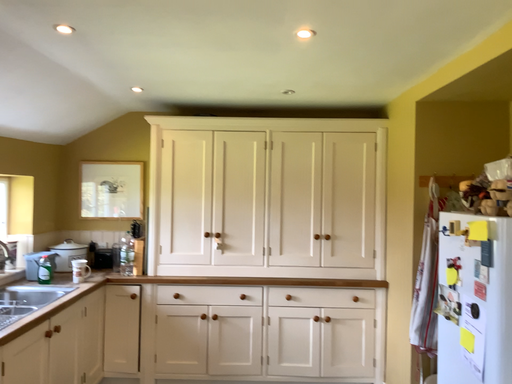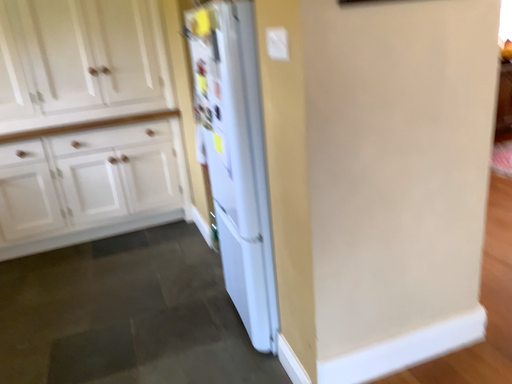
Question: How did the camera likely rotate when shooting the video?

Choices:
 (A) rotated downward
 (B) rotated upward

Answer: (A)